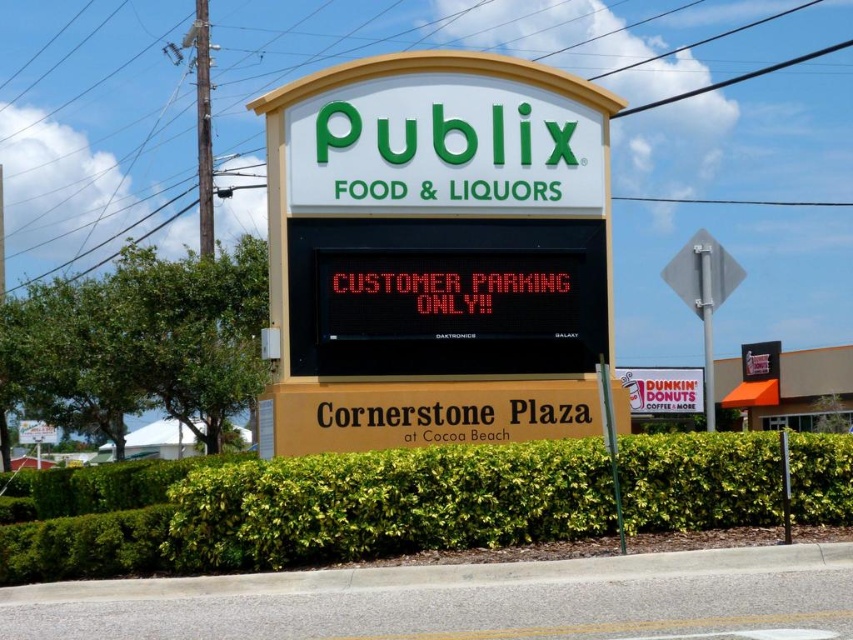
Question: Estimate the real-world distances between objects in this image. Which object is farther from the orange awning at right?

Choices:
 (A) green leafy hedge at center
 (B) yellow matte sign at center
 (C) white paper dunkin' donuts sign at center

Answer: (A)

Question: Among these points, which one is nearest to the camera?

Choices:
 (A) (546, 404)
 (B) (677, 384)

Answer: (A)

Question: Where is yellow matte sign at center located in relation to white paper dunkin' donuts sign at center in the image?

Choices:
 (A) above
 (B) below

Answer: (A)

Question: Which object appears closest to the camera in this image?

Choices:
 (A) green leafy hedge at center
 (B) white paper dunkin' donuts sign at center
 (C) yellow matte sign at center
 (D) orange awning at right

Answer: (A)

Question: Can you confirm if green leafy hedge at center is thinner than orange awning at right?

Choices:
 (A) yes
 (B) no

Answer: (B)

Question: Where is orange awning at right located in relation to white paper dunkin' donuts sign at center in the image?

Choices:
 (A) left
 (B) right

Answer: (B)